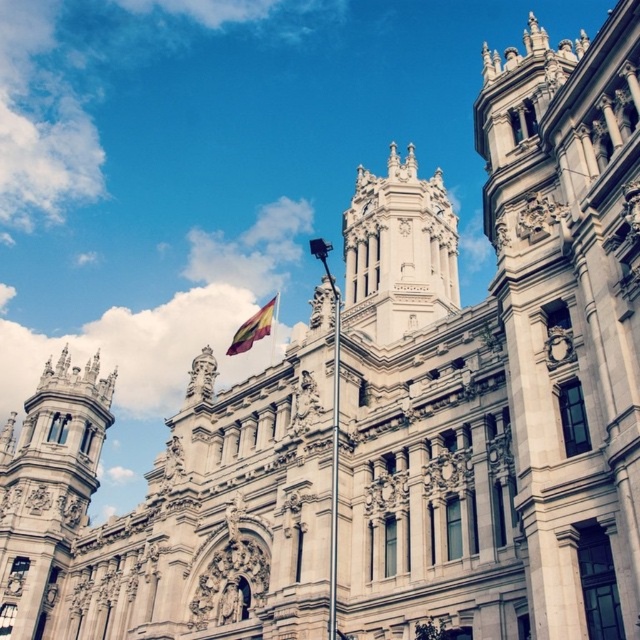
You are standing in front of the grand ornate building with a Spanish flag. Where is the white stone tower at left located in terms of coordinates?

The white stone tower at left is located at coordinates point (x=48, y=488).